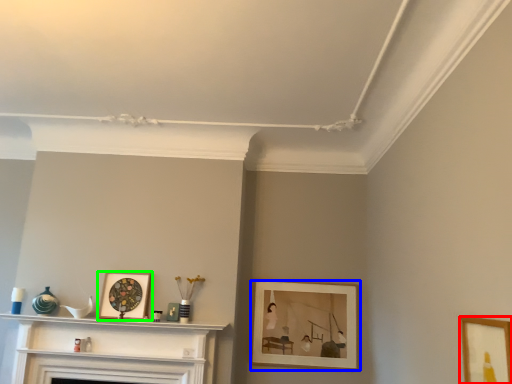
Question: Which object is positioned farthest from picture frame (highlighted by a red box)? Select from picture frame (highlighted by a blue box) and picture frame (highlighted by a green box).

Choices:
 (A) picture frame
 (B) picture frame

Answer: (B)